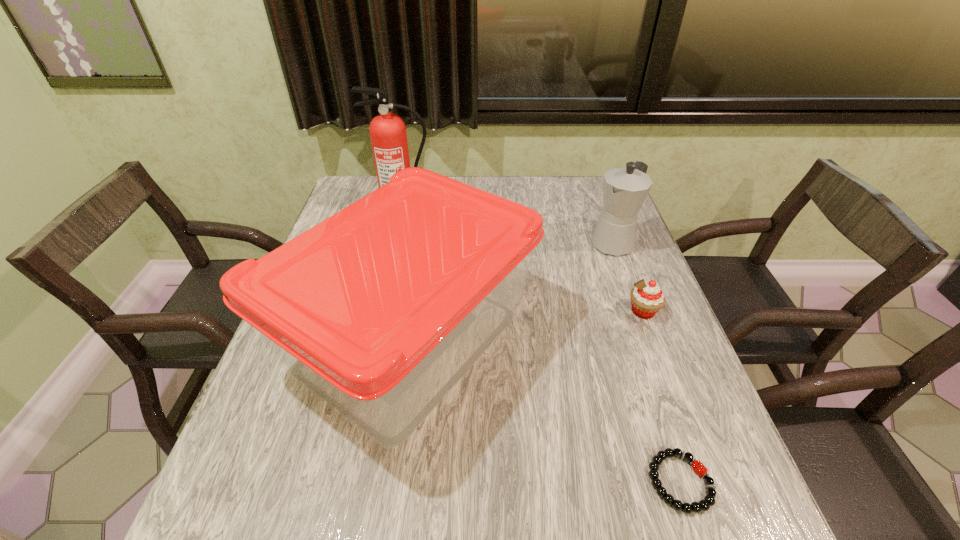
Find the location of a particular element. the tallest object is located at coordinates (388, 135).

Locate an element on the screen. the farthest object is located at coordinates (388, 135).

Where is `tray`? The height and width of the screenshot is (540, 960). tray is located at coordinates (378, 311).

At what (x,y) coordinates should I click in order to perform the action: click on coffeepot. Please return your answer as a coordinate pair (x, y). Looking at the image, I should click on (624, 189).

Find the location of `the second shortest object`. the second shortest object is located at coordinates (647, 298).

The height and width of the screenshot is (540, 960). What are the coordinates of `bracelet` in the screenshot? It's located at (709, 500).

In order to click on vacant space situated 0.330m on the handle side of the fire extinguisher in this screenshot , I will do `click(383, 289)`.

Locate an element on the screen. Image resolution: width=960 pixels, height=540 pixels. free space located 0.320m on the back of the tray is located at coordinates (432, 193).

Locate an element on the screen. The image size is (960, 540). blank area located on the front of the coffeepot is located at coordinates (644, 322).

Identify the location of vacant space located on the front of the second shortest object. This screenshot has width=960, height=540. (691, 440).